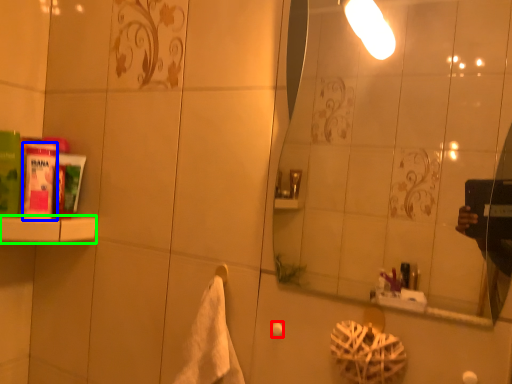
Question: Based on their relative distances, which object is farther from towel bar (highlighted by a red box)? Choose from mouthwash (highlighted by a blue box) and shelf (highlighted by a green box).

Choices:
 (A) mouthwash
 (B) shelf

Answer: (A)